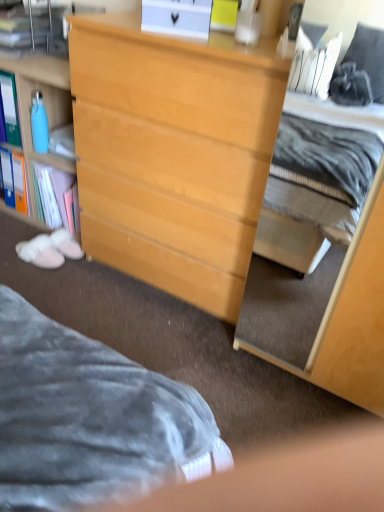
Question: Is light wood dresser at center, the second cabinetry from the left, to the left of light wood dresser at center from the viewer's perspective?

Choices:
 (A) no
 (B) yes

Answer: (A)

Question: Is light wood dresser at center, the 1th cabinetry in the right-to-left sequence, next to light wood dresser at center?

Choices:
 (A) yes
 (B) no

Answer: (B)

Question: Is light wood dresser at center, the second cabinetry from the left, positioned beyond the bounds of light wood dresser at center?

Choices:
 (A) no
 (B) yes

Answer: (B)

Question: Is light wood dresser at center, the 1th cabinetry in the right-to-left sequence, facing towards light wood dresser at center?

Choices:
 (A) no
 (B) yes

Answer: (A)

Question: From the image's perspective, does light wood dresser at center, the second cabinetry from the left, appear higher than light wood dresser at center?

Choices:
 (A) yes
 (B) no

Answer: (B)

Question: Considering the positions of light wood dresser at center, the 1th cabinetry in the right-to-left sequence, and light wood cabinet at center, which ranks as the first cabinetry in left-to-right order, in the image, is light wood dresser at center, the 1th cabinetry in the right-to-left sequence, wider or thinner than light wood cabinet at center, which ranks as the first cabinetry in left-to-right order,?

Choices:
 (A) wide
 (B) thin

Answer: (A)

Question: Is light wood dresser at center, the 1th cabinetry in the right-to-left sequence, inside the boundaries of light wood cabinet at center, which ranks as the first cabinetry in left-to-right order, or outside?

Choices:
 (A) inside
 (B) outside

Answer: (B)

Question: Is point (349, 312) closer or farther from the camera than point (61, 210)?

Choices:
 (A) closer
 (B) farther

Answer: (A)

Question: From the image's perspective, is light wood dresser at center, the 1th cabinetry in the right-to-left sequence, located above or below light wood cabinet at center, which ranks as the first cabinetry in left-to-right order?

Choices:
 (A) below
 (B) above

Answer: (A)

Question: From the image's perspective, is light wood cabinet at center, which ranks as the first cabinetry in left-to-right order, located above or below light wood dresser at center, the 1th cabinetry in the right-to-left sequence?

Choices:
 (A) above
 (B) below

Answer: (A)

Question: From their relative heights in the image, would you say light wood cabinet at center, which ranks as the first cabinetry in left-to-right order, is taller or shorter than light wood dresser at center, the 1th cabinetry in the right-to-left sequence?

Choices:
 (A) short
 (B) tall

Answer: (A)

Question: Looking at their shapes, would you say light wood cabinet at center, the second cabinetry positioned from the right, is wider or thinner than light wood dresser at center, the 1th cabinetry in the right-to-left sequence?

Choices:
 (A) thin
 (B) wide

Answer: (A)

Question: Is point (61, 137) closer or farther from the camera than point (370, 403)?

Choices:
 (A) closer
 (B) farther

Answer: (B)

Question: Considering the positions of light wood dresser at center, the 1th cabinetry in the right-to-left sequence, and light wood dresser at center in the image, is light wood dresser at center, the 1th cabinetry in the right-to-left sequence, wider or thinner than light wood dresser at center?

Choices:
 (A) wide
 (B) thin

Answer: (A)

Question: Is light wood dresser at center, the 1th cabinetry in the right-to-left sequence, taller or shorter than light wood dresser at center?

Choices:
 (A) short
 (B) tall

Answer: (B)